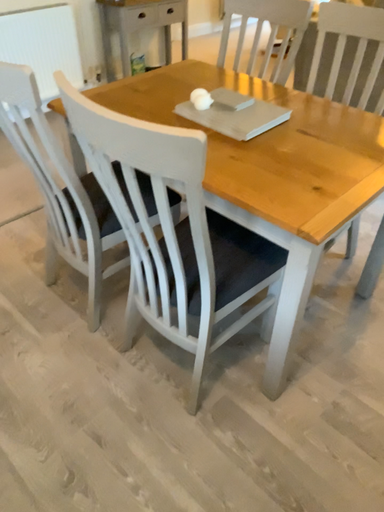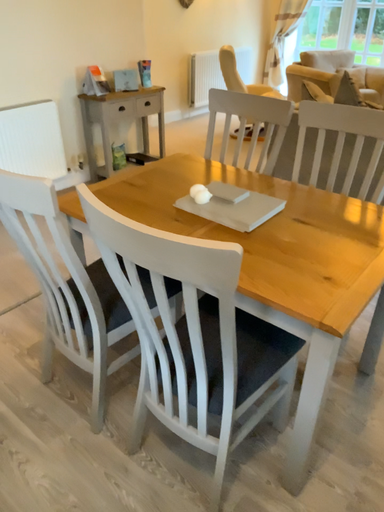
Question: How did the camera likely rotate when shooting the video?

Choices:
 (A) rotated downward
 (B) rotated upward

Answer: (B)